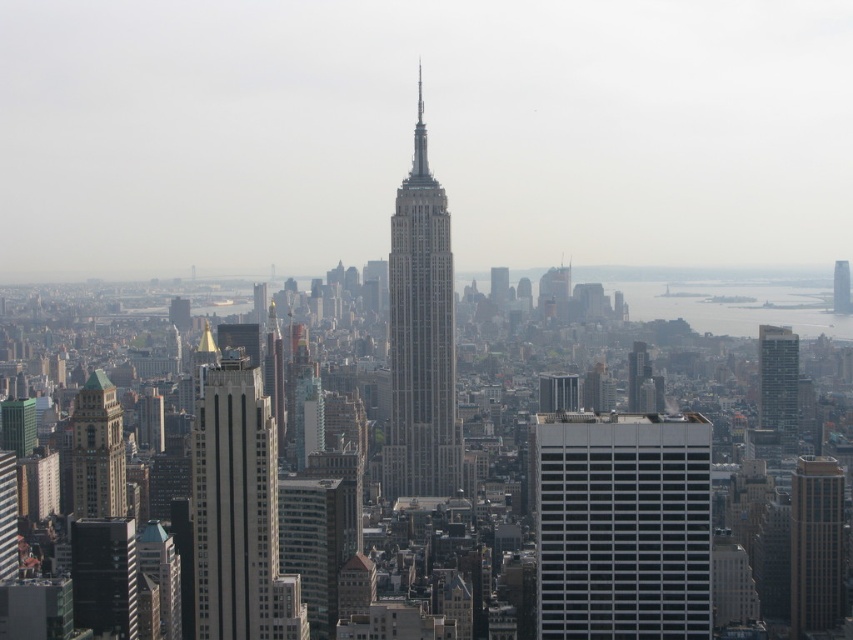
You are a city planner reviewing the city layout. You notice the white glass building at center and the gray concrete skyscraper at center. Which one is positioned lower in the image?

The white glass building at center is located below the gray concrete skyscraper at center, so it is positioned lower in the image.